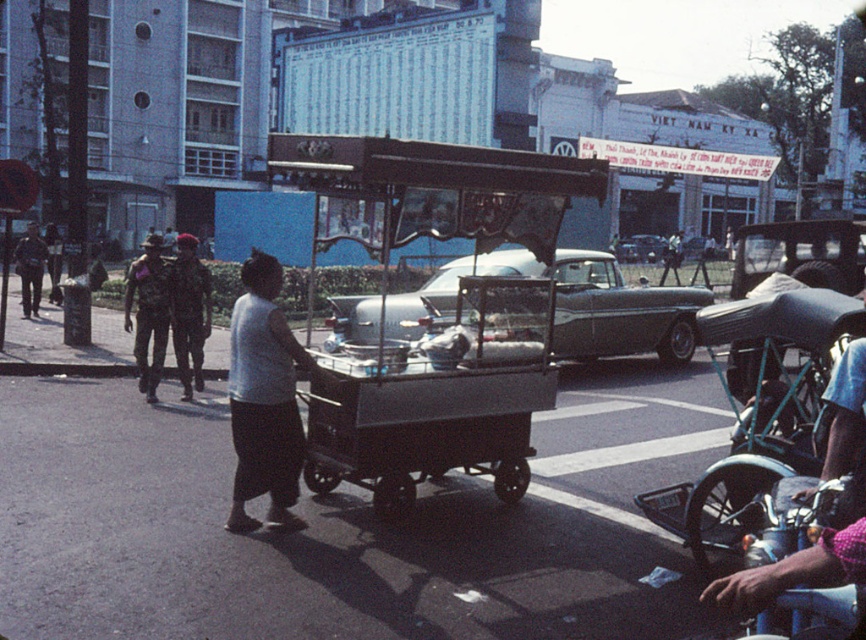
Looking at this image, which is more to the right, silver metallic car at center or camouflage uniform at left?

Positioned to the right is silver metallic car at center.

Is point (391, 308) behind point (31, 291)?

That is False.

Between point (585, 300) and point (23, 304), which one is positioned in front?

Point (585, 300) is in front.

The height and width of the screenshot is (640, 866). What are the coordinates of `silver metallic car at center` in the screenshot? It's located at (619, 310).

Does white matte shirt at center have a greater height compared to camouflage uniform at center?

No.

Which is more to the left, white matte shirt at center or camouflage uniform at center?

From the viewer's perspective, camouflage uniform at center appears more on the left side.

Is point (263, 417) farther from viewer compared to point (209, 321)?

No.

The height and width of the screenshot is (640, 866). What are the coordinates of `white matte shirt at center` in the screenshot? It's located at pos(263,397).

Does silver metallic car at center have a larger size compared to silver metallic sedan at center?

Correct, silver metallic car at center is larger in size than silver metallic sedan at center.

Which is behind, point (496, 273) or point (641, 244)?

Positioned behind is point (641, 244).

This screenshot has height=640, width=866. Find the location of `silver metallic car at center`. silver metallic car at center is located at coordinates (619, 310).

The height and width of the screenshot is (640, 866). Identify the location of silver metallic car at center. (619, 310).